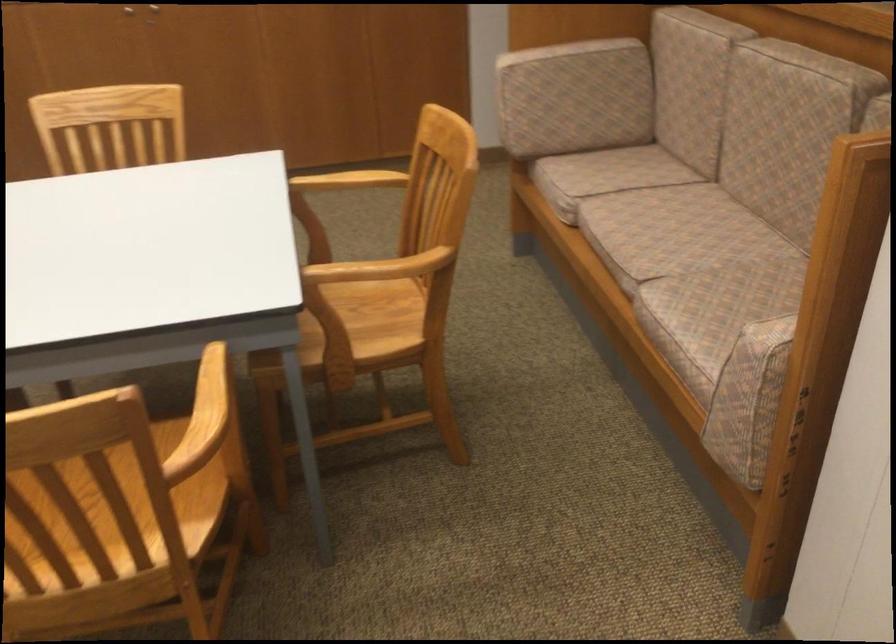
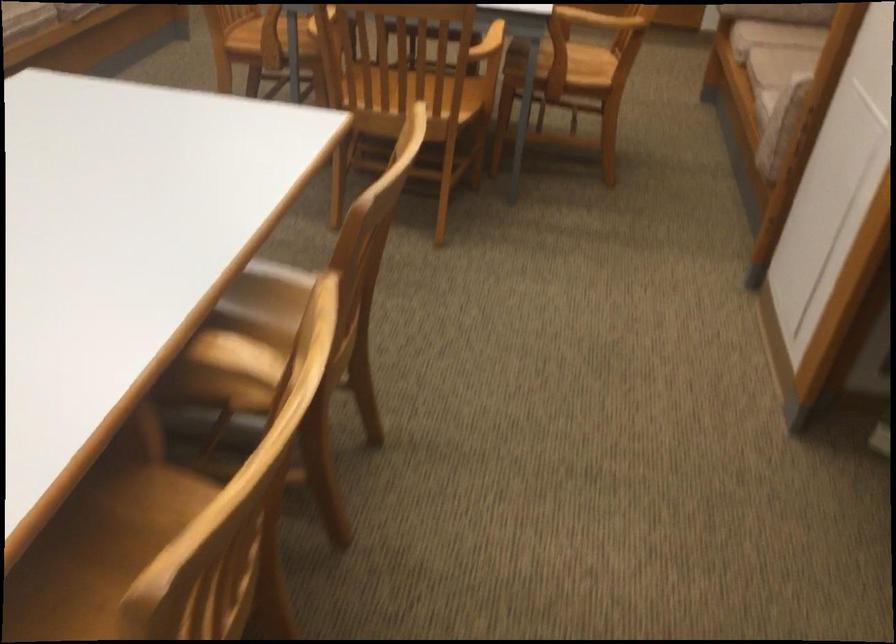
The point at [360,341] is marked in the first image. Where is the corresponding point in the second image?

(570, 69)